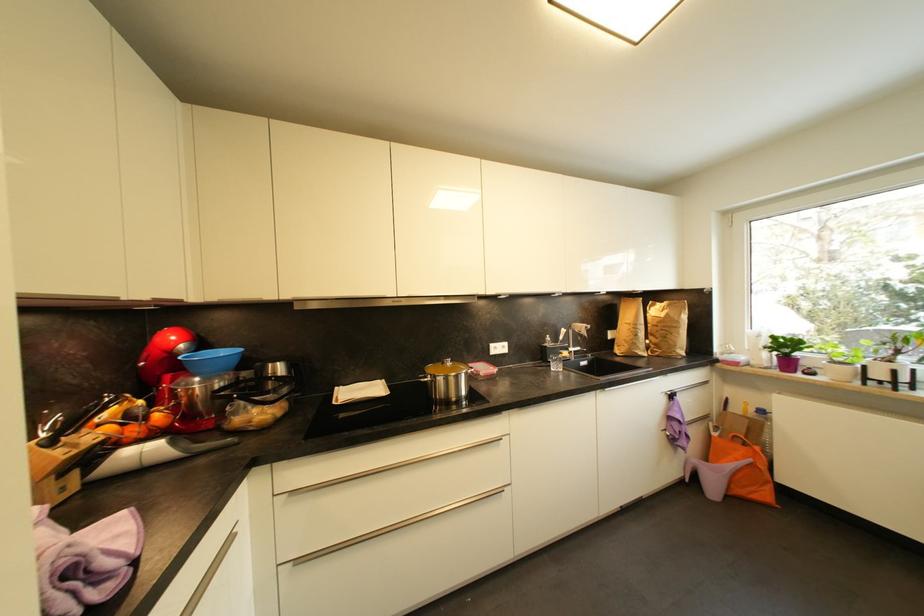
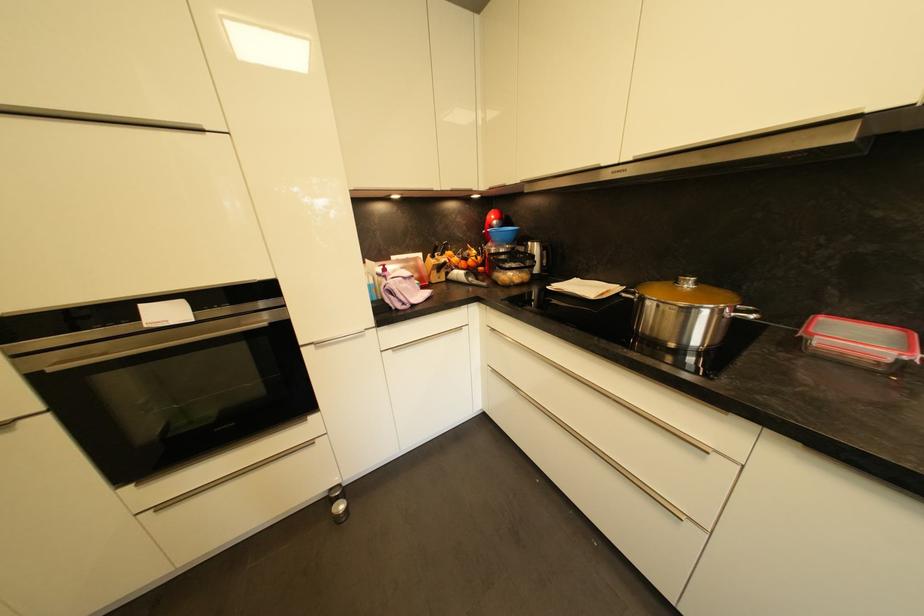
Question: I am providing you with two images of the same scene from different viewpoints. Please identify which objects are invisible in image2.

Choices:
 (A) kettle handle
 (B) blue mixing bowl
 (C) red lid clip
 (D) none of these

Answer: (D)